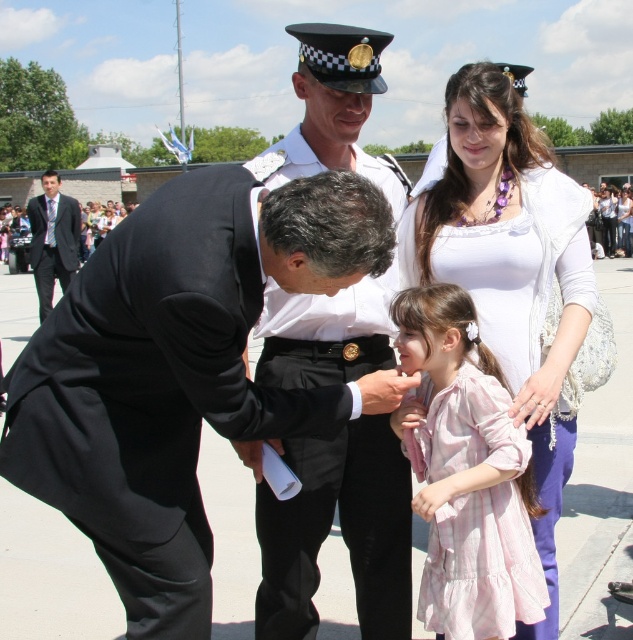
Based on the coordinates provided, where is the pink cotton dress at center located in the image?

The pink cotton dress at center is located at the 2D coordinates point (467, 474).

You are standing in the crowd watching the scene. Which person is closer to you, the black suit at left or the white cotton dress at center?

The black suit at left is closer to you because it is further to the viewer than the white cotton dress at center.

You are at an outdoor event and see a man in a black suit at left and a girl in a pink cotton dress at center. Which of these two is positioned more to the right side of the scene?

The pink cotton dress at center is positioned to the right of the black suit at left, so the girl in the pink cotton dress at center is more to the right side of the scene.